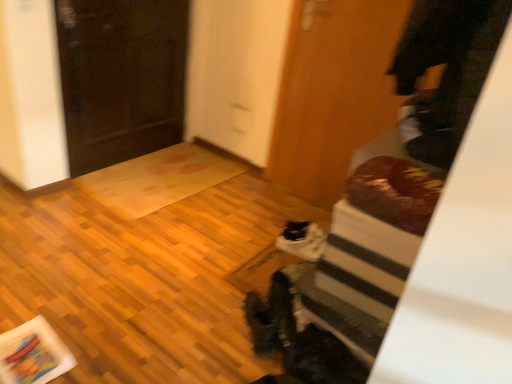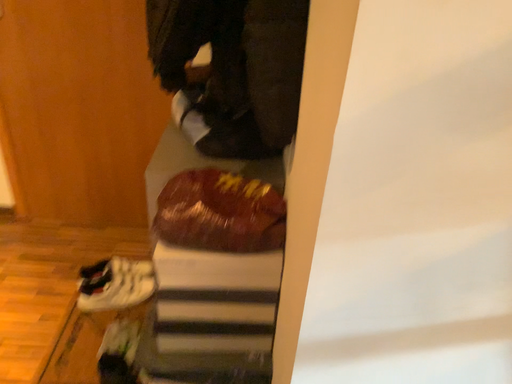
Question: How did the camera likely rotate when shooting the video?

Choices:
 (A) rotated right
 (B) rotated left

Answer: (A)